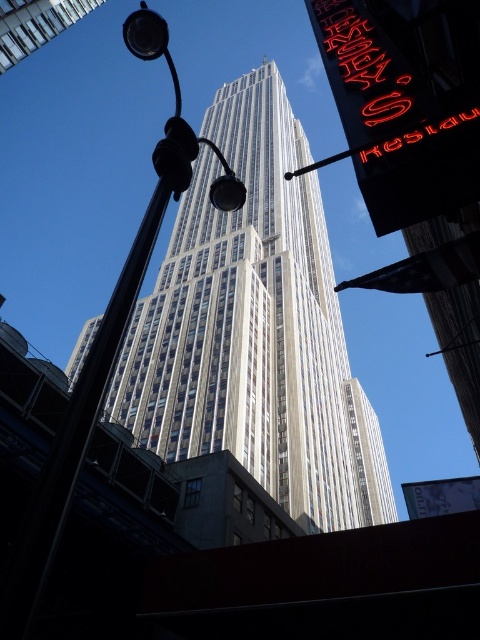
Question: Does white glass skyscraper at center lie in front of metallic streetlight at center?

Choices:
 (A) yes
 (B) no

Answer: (B)

Question: Is white glass skyscraper at center positioned at the back of metallic streetlight at center?

Choices:
 (A) no
 (B) yes

Answer: (B)

Question: Is white glass skyscraper at center above metallic streetlight at center?

Choices:
 (A) yes
 (B) no

Answer: (A)

Question: Which point is farther from the camera taking this photo?

Choices:
 (A) (26, 604)
 (B) (176, 324)

Answer: (B)

Question: Which object is farther from the camera taking this photo?

Choices:
 (A) white glass skyscraper at center
 (B) metallic streetlight at center

Answer: (A)